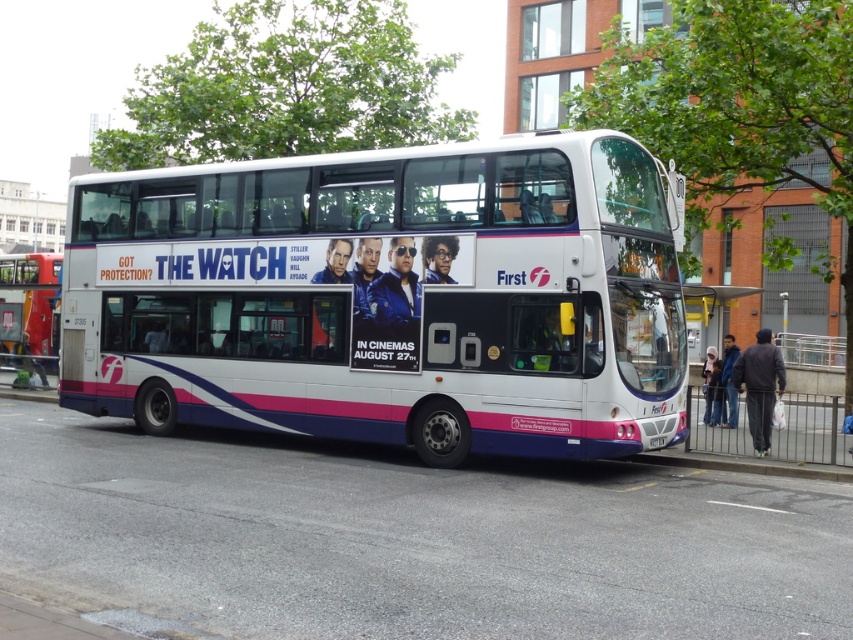
Where is `white glossy decker bus at center`? white glossy decker bus at center is located at coordinates (386, 298).

Can you confirm if white glossy decker bus at center is bigger than white plastic bus at left?

Yes, white glossy decker bus at center is bigger than white plastic bus at left.

Describe the element at coordinates (386, 298) in the screenshot. This screenshot has width=853, height=640. I see `white glossy decker bus at center` at that location.

I want to click on white glossy decker bus at center, so click(x=386, y=298).

Does point (13, 353) lie behind point (659, 442)?

Yes, point (13, 353) is farther from viewer.

Who is positioned more to the right, white plastic bus at left or white plastic license plate at center?

white plastic license plate at center

Which is in front, point (15, 362) or point (659, 436)?

Positioned in front is point (659, 436).

Locate an element on the screen. The width and height of the screenshot is (853, 640). white plastic bus at left is located at coordinates (28, 310).

Between white glossy decker bus at center and white plastic license plate at center, which one has more height?

With more height is white glossy decker bus at center.

Does white glossy decker bus at center have a lesser width compared to white plastic license plate at center?

In fact, white glossy decker bus at center might be wider than white plastic license plate at center.

Is point (596, 339) behind point (660, 436)?

No, (596, 339) is in front of (660, 436).

In order to click on white glossy decker bus at center in this screenshot , I will do `click(386, 298)`.